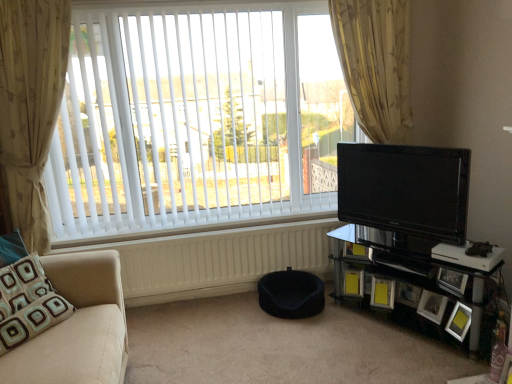
Identify the location of vacant space in between black glass entertainment center at lower right and black fabric bean bag at center. (358, 333).